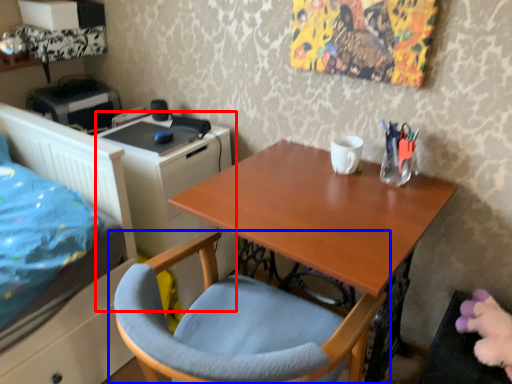
Question: Which point is further to the camera, file cabinet (highlighted by a red box) or chair (highlighted by a blue box)?

Choices:
 (A) file cabinet
 (B) chair

Answer: (A)